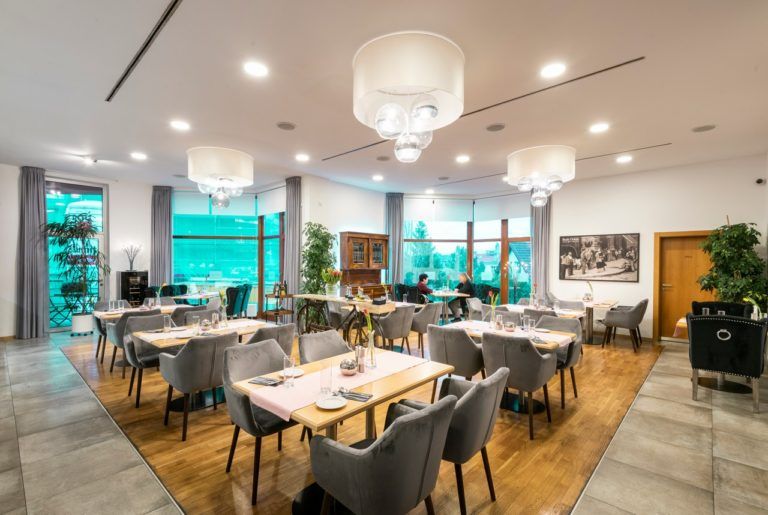
Image resolution: width=768 pixels, height=515 pixels. What are the coordinates of `curtain` in the screenshot? It's located at (543, 226), (396, 217), (293, 225), (164, 221), (25, 237).